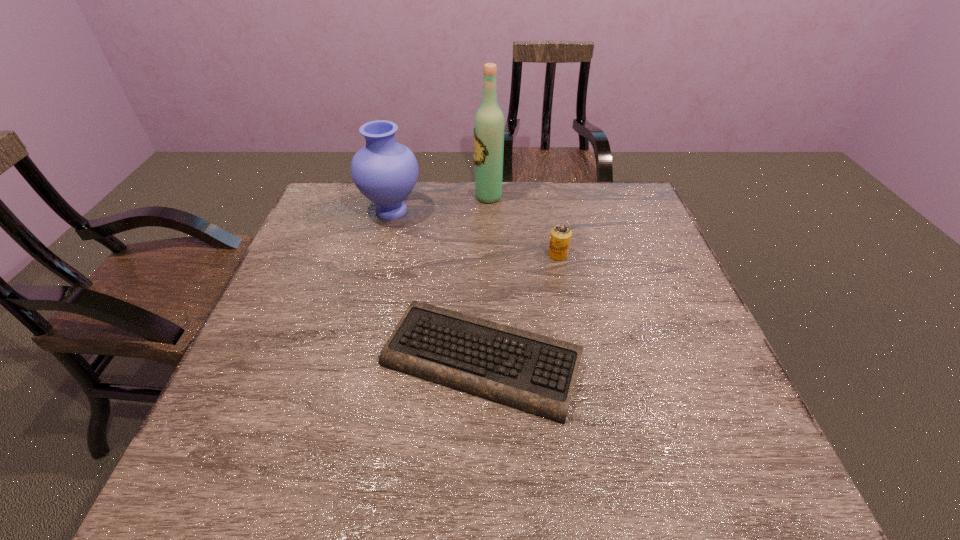
Identify the location of free region at the far left corner of the desktop. Image resolution: width=960 pixels, height=540 pixels. (327, 188).

This screenshot has width=960, height=540. Identify the location of vacant point located between the vase and the third tallest object. (475, 233).

Find the location of a particular element. vacant space that is in between the wine bottle and the nearest object is located at coordinates (485, 278).

At what (x,y) coordinates should I click in order to perform the action: click on unoccupied area between the vase and the third tallest object. Please return your answer as a coordinate pair (x, y). Looking at the image, I should click on (475, 233).

Image resolution: width=960 pixels, height=540 pixels. I want to click on free space between the second nearest object and the vase, so tap(475, 233).

Image resolution: width=960 pixels, height=540 pixels. I want to click on free space between the computer keyboard and the second tallest object, so click(x=437, y=286).

Locate an element on the screen. Image resolution: width=960 pixels, height=540 pixels. free point between the second shortest object and the tallest object is located at coordinates click(523, 226).

Where is `free space between the tallest object and the vase`? The width and height of the screenshot is (960, 540). free space between the tallest object and the vase is located at coordinates (440, 204).

You are a GUI agent. You are given a task and a screenshot of the screen. Output one action in this format:
    pyautogui.click(x=<x>, y=<y>)
    Task: Click on the free spot between the nearest object and the tallest object
    The image size is (960, 540).
    Given the screenshot: What is the action you would take?
    pyautogui.click(x=485, y=278)

Locate an element on the screen. The image size is (960, 540). free area in between the wine bottle and the shortest object is located at coordinates (485, 278).